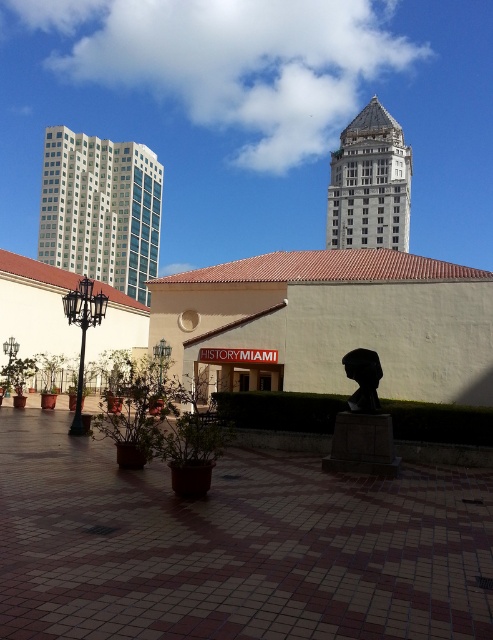
Question: Which object appears closest to the camera in this image?

Choices:
 (A) gray stone tower at upper center
 (B) white glass building at upper left
 (C) black matte bust at center

Answer: (C)

Question: Considering the real-world distances, which object is farthest from the white glass building at upper left?

Choices:
 (A) gray stone tower at upper center
 (B) black matte bust at center

Answer: (B)

Question: Does white glass building at upper left appear under black matte bust at center?

Choices:
 (A) yes
 (B) no

Answer: (B)

Question: Is white glass building at upper left wider than black matte bust at center?

Choices:
 (A) no
 (B) yes

Answer: (B)

Question: Which point appears farthest from the camera in this image?

Choices:
 (A) (375, 404)
 (B) (116, 275)

Answer: (B)

Question: Can you confirm if white glass building at upper left is positioned below black matte bust at center?

Choices:
 (A) no
 (B) yes

Answer: (A)